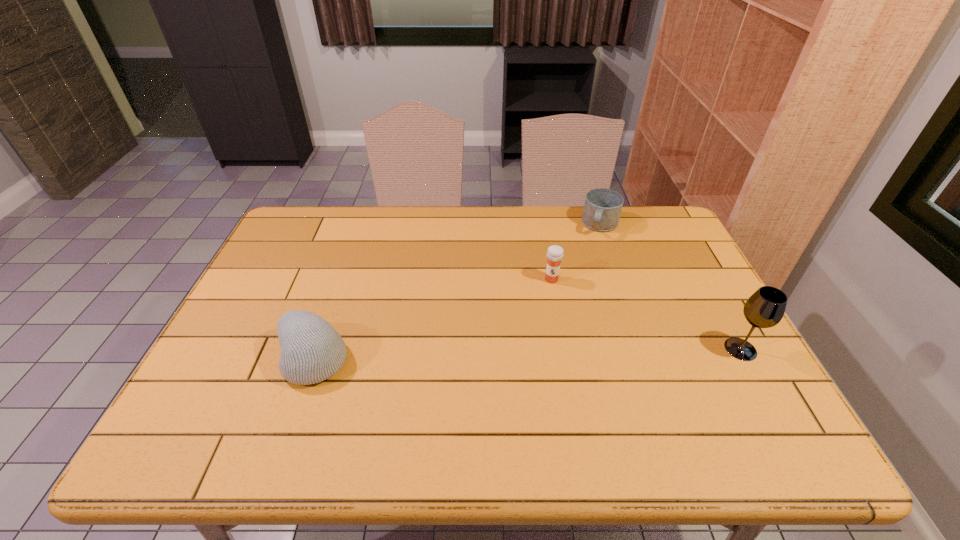
The image size is (960, 540). I want to click on free spot on the desktop that is between the leftmost object and the tallest object and is positioned on the label side of the medicine, so (x=536, y=354).

Image resolution: width=960 pixels, height=540 pixels. I want to click on vacant space on the desktop that is between the beanie and the tallest object and is positioned on the side of the second object from right to left with the handle, so click(x=550, y=353).